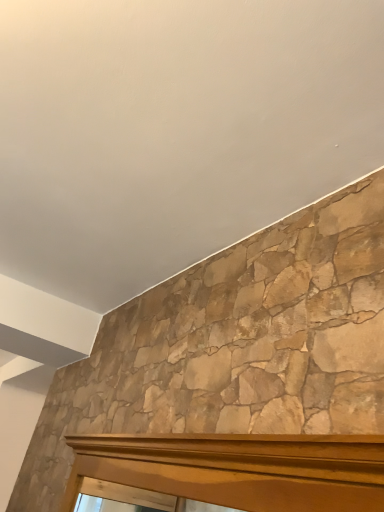
In order to face matte wood window frame at center, should I rotate leftwards or rightwards?

You should rotate left by 6.218 degrees.

At what (x,y) coordinates should I click in order to perform the action: click on matte wood window frame at center. Please return your answer as a coordinate pair (x, y). Image resolution: width=384 pixels, height=512 pixels. Looking at the image, I should click on (239, 469).

This screenshot has width=384, height=512. What do you see at coordinates (239, 469) in the screenshot?
I see `matte wood window frame at center` at bounding box center [239, 469].

Locate an element on the screen. This screenshot has width=384, height=512. matte wood window frame at center is located at coordinates (239, 469).